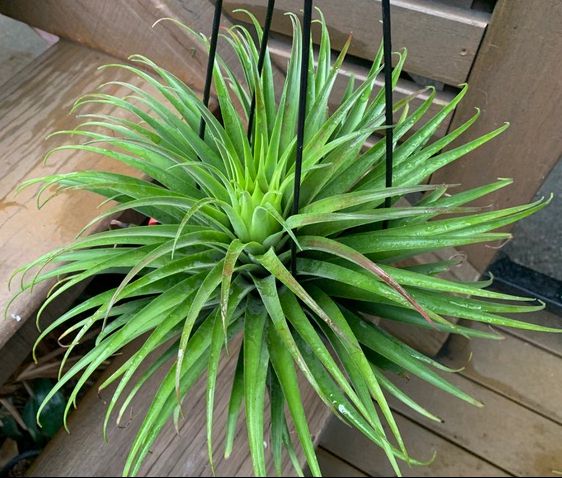
Locate an element on the screen. floor is located at coordinates (484, 434).